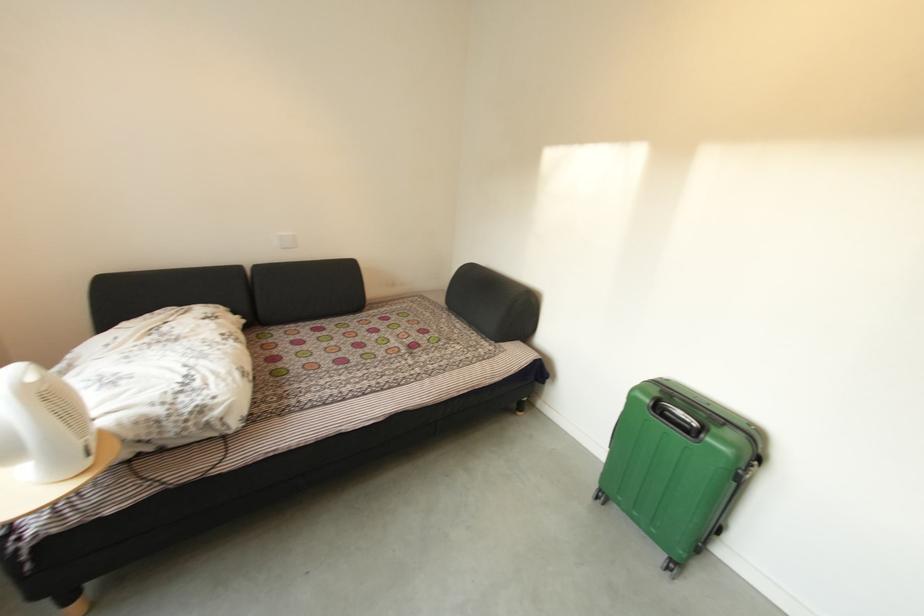
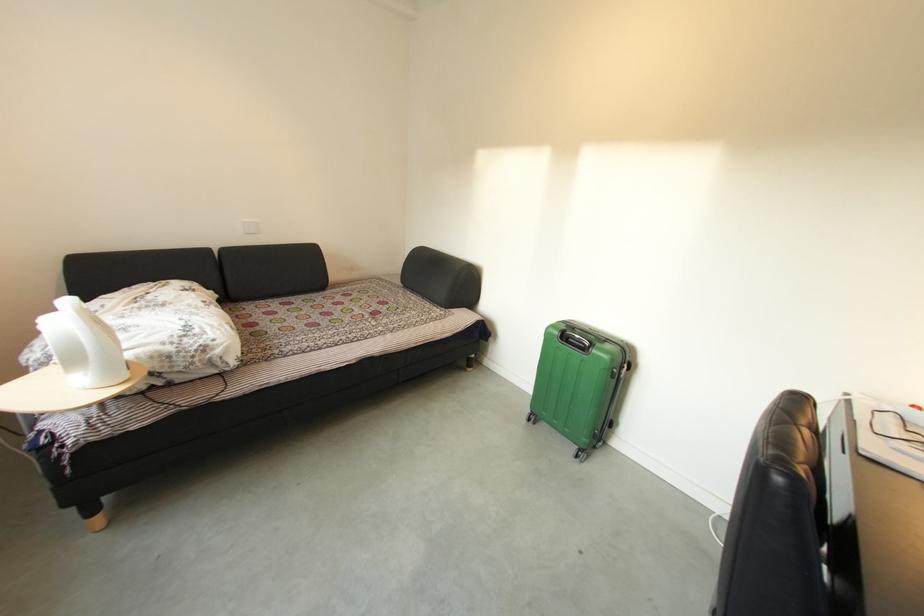
In the second image, find the point that corresponds to point (660, 405) in the first image.

(568, 336)